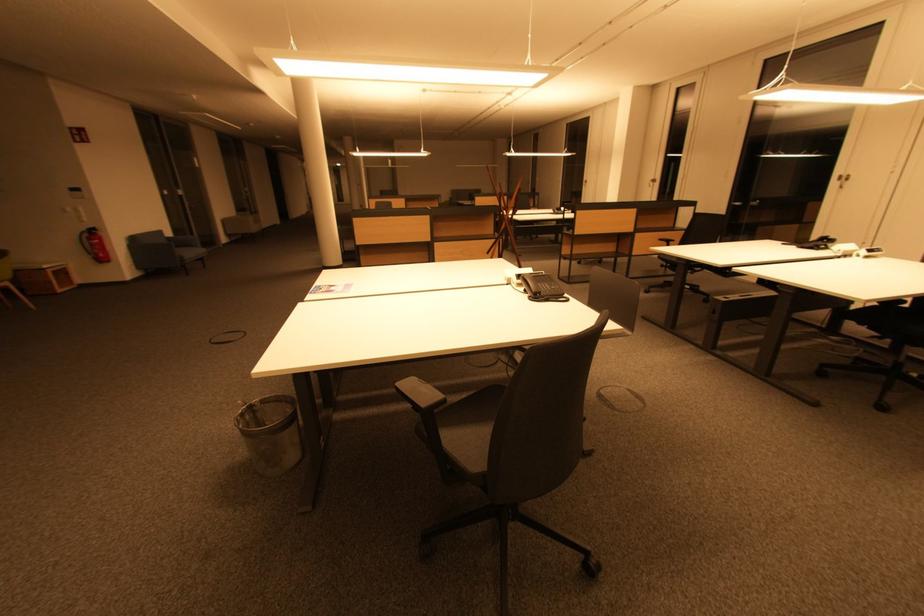
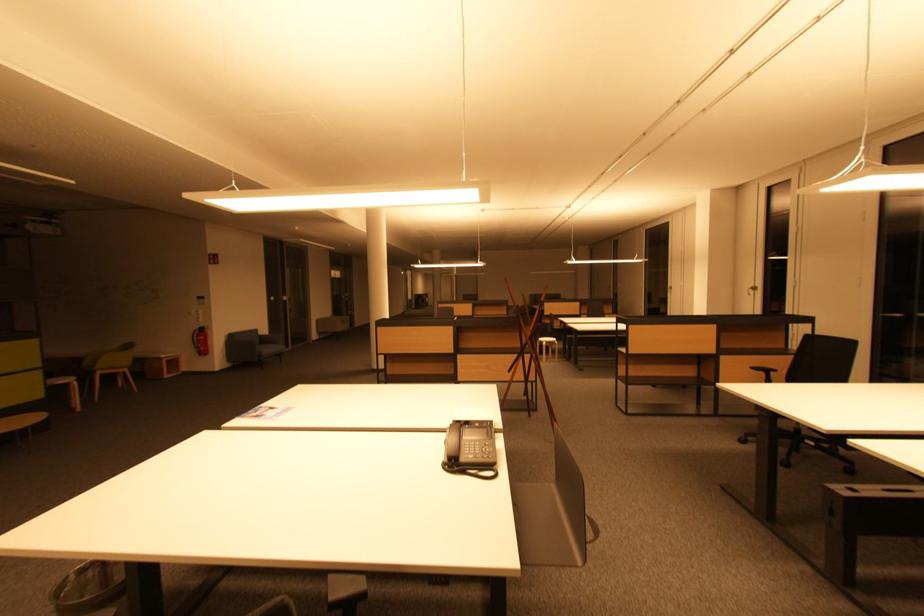
Find the pixel in the second image that matches [536,297] in the first image.

(450, 463)